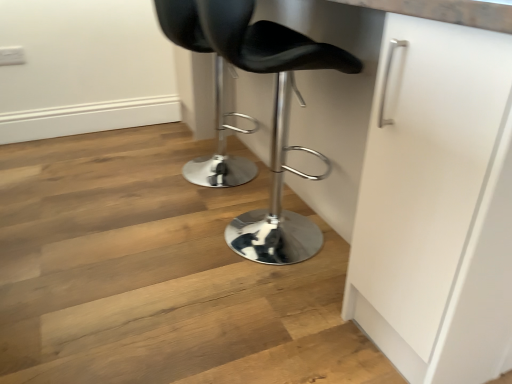
At what (x,y) coordinates should I click in order to perform the action: click on free space in front of black leather stool at center, the first chair when ordered from back to front. Please return your answer as a coordinate pair (x, y). The width and height of the screenshot is (512, 384). Looking at the image, I should click on (169, 211).